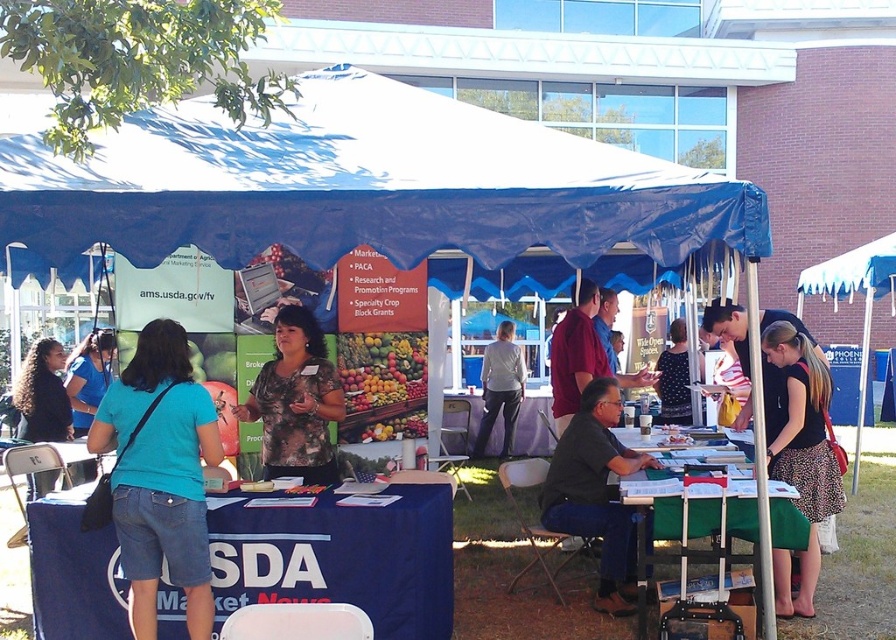
Looking at this image, which is more to the right, blue fabric table at lower left or dark brown hair at center?

Positioned to the right is blue fabric table at lower left.

Is point (317, 504) positioned in front of point (47, 339)?

Yes.

The height and width of the screenshot is (640, 896). Identify the location of blue fabric table at lower left. (340, 557).

Which is behind, point (571, 160) or point (97, 358)?

Point (97, 358)

Is white fabric canopy at upper center bigger than blue t-shirt at center?

Indeed, white fabric canopy at upper center has a larger size compared to blue t-shirt at center.

The height and width of the screenshot is (640, 896). What do you see at coordinates (369, 188) in the screenshot?
I see `white fabric canopy at upper center` at bounding box center [369, 188].

Find the location of a particular element. Image resolution: width=896 pixels, height=640 pixels. white fabric canopy at upper center is located at coordinates (369, 188).

Between point (444, 404) and point (520, 369), which one is positioned behind?

Positioned behind is point (520, 369).

Between point (518, 442) and point (503, 451), which one is positioned in front?

Positioned in front is point (503, 451).

What do you see at coordinates (533, 428) in the screenshot? I see `blue fabric table at center` at bounding box center [533, 428].

Where is `blue fabric table at center`? blue fabric table at center is located at coordinates (533, 428).